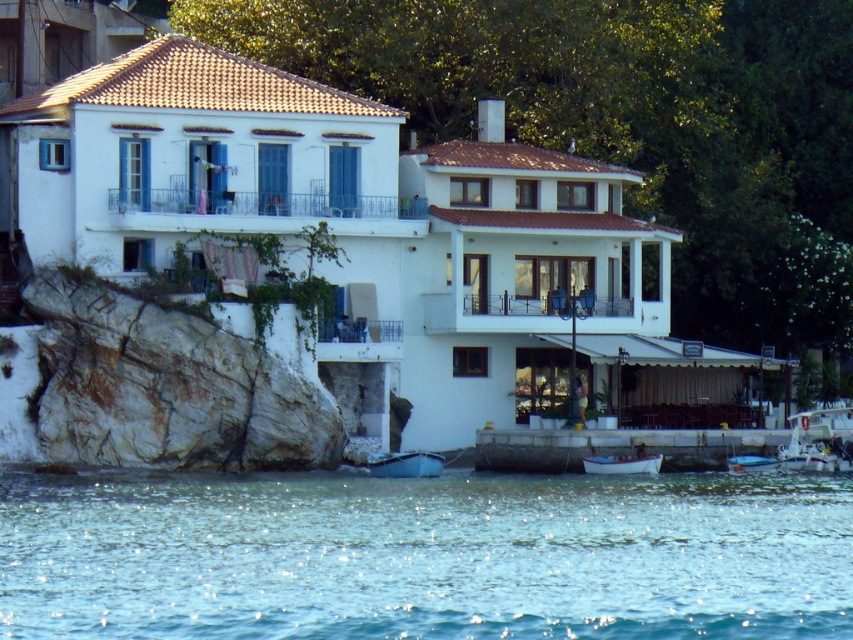
Locate an element on the screen. The width and height of the screenshot is (853, 640). white plastic boat at lower right is located at coordinates (819, 442).

Is white plastic boat at lower right below metallic blue boat at lower right?

No, white plastic boat at lower right is not below metallic blue boat at lower right.

Is point (817, 428) more distant than point (749, 468)?

Yes, point (817, 428) is farther from viewer.

Image resolution: width=853 pixels, height=640 pixels. In order to click on white plastic boat at lower right in this screenshot , I will do `click(819, 442)`.

Does clear blue water at lower center have a lesser height compared to white glossy boat at lower center?

Incorrect, clear blue water at lower center's height does not fall short of white glossy boat at lower center's.

Is clear blue water at lower center above white glossy boat at lower center?

No.

Where is `clear blue water at lower center`? clear blue water at lower center is located at coordinates (424, 556).

Identify the location of clear blue water at lower center. This screenshot has height=640, width=853. (424, 556).

Does white rock at lower left appear on the right side of white plastic boat at lower right?

In fact, white rock at lower left is to the left of white plastic boat at lower right.

Does point (258, 442) come farther from viewer compared to point (843, 440)?

No, it is in front of (843, 440).

Is point (154, 449) closer to viewer compared to point (811, 442)?

That is True.

I want to click on white rock at lower left, so click(x=165, y=385).